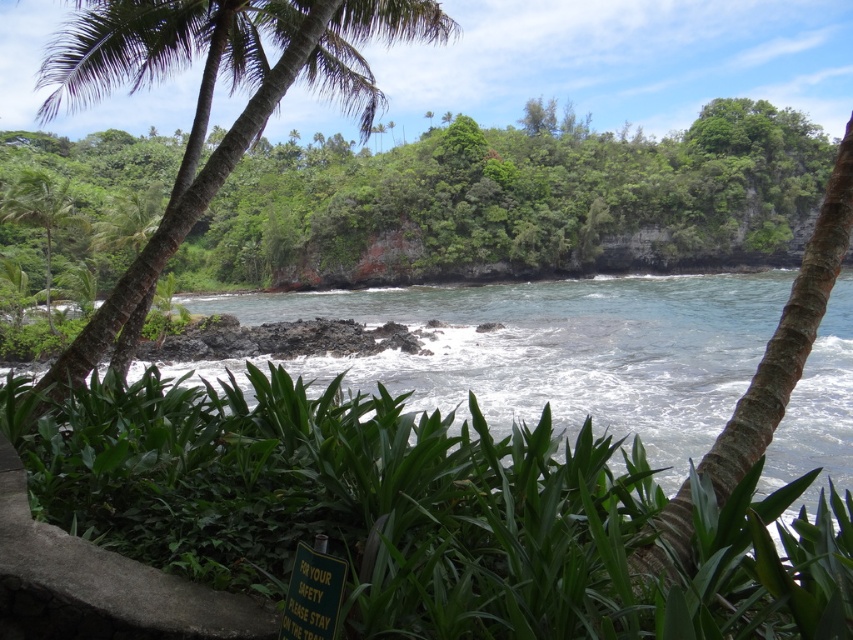
Question: Among these points, which one is farthest from the camera?

Choices:
 (A) (47, 237)
 (B) (254, 97)

Answer: (A)

Question: Is clear blue water at center closer to the viewer compared to green leafy palm tree at left?

Choices:
 (A) yes
 (B) no

Answer: (A)

Question: Considering the real-world distances, which object is farthest from the clear blue water at center?

Choices:
 (A) green textured palm tree at left
 (B) green leafy palm tree at left

Answer: (B)

Question: Can you confirm if clear blue water at center is positioned below green textured palm tree at left?

Choices:
 (A) no
 (B) yes

Answer: (B)

Question: Which object appears closest to the camera in this image?

Choices:
 (A) clear blue water at center
 (B) green leafy palm tree at left
 (C) green textured palm tree at left

Answer: (C)

Question: Does clear blue water at center have a lesser width compared to green leafy palm tree at left?

Choices:
 (A) yes
 (B) no

Answer: (B)